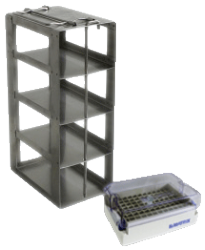
Identify the location of corner. Image resolution: width=205 pixels, height=250 pixels. (9, 15).